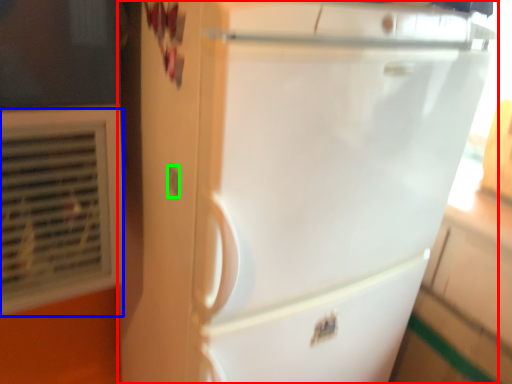
Question: Which object is positioned closest to refrigerator (highlighted by a red box)? Select from air conditioning (highlighted by a blue box) and electric outlet (highlighted by a green box).

Choices:
 (A) air conditioning
 (B) electric outlet

Answer: (A)